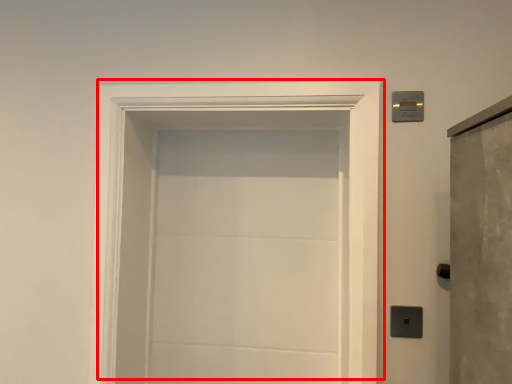
Question: Considering the relative positions of door (annotated by the red box) and light switch in the image provided, where is door (annotated by the red box) located with respect to the staircase?

Choices:
 (A) left
 (B) right

Answer: (A)